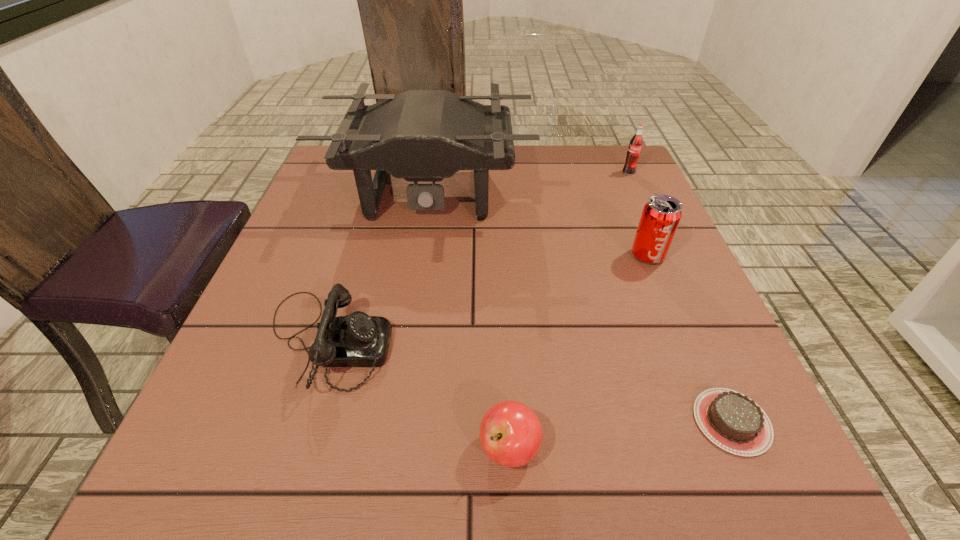
Locate an element on the screen. The width and height of the screenshot is (960, 540). free point located 0.260m on the back of the apple is located at coordinates (502, 297).

Where is `free space located 0.290m on the back of the shortest object`? Image resolution: width=960 pixels, height=540 pixels. free space located 0.290m on the back of the shortest object is located at coordinates (664, 267).

Locate an element on the screen. drone that is at the far edge is located at coordinates (420, 135).

Find the location of a particular element. Image resolution: width=960 pixels, height=540 pixels. soda bottle that is at the far edge is located at coordinates (634, 150).

Where is `apple at the near edge`? apple at the near edge is located at coordinates (510, 433).

Identify the location of chocolate cake that is at the near edge. Image resolution: width=960 pixels, height=540 pixels. (731, 420).

Find the location of `drone present at the left edge`. drone present at the left edge is located at coordinates click(420, 135).

Image resolution: width=960 pixels, height=540 pixels. I want to click on telephone located in the left edge section of the desktop, so click(x=356, y=340).

At what (x,y) coordinates should I click in order to perform the action: click on chocolate cake at the right edge. Please return your answer as a coordinate pair (x, y). Image resolution: width=960 pixels, height=540 pixels. Looking at the image, I should click on (731, 420).

Image resolution: width=960 pixels, height=540 pixels. What are the coordinates of `object situated at the far left corner` in the screenshot? It's located at (420, 135).